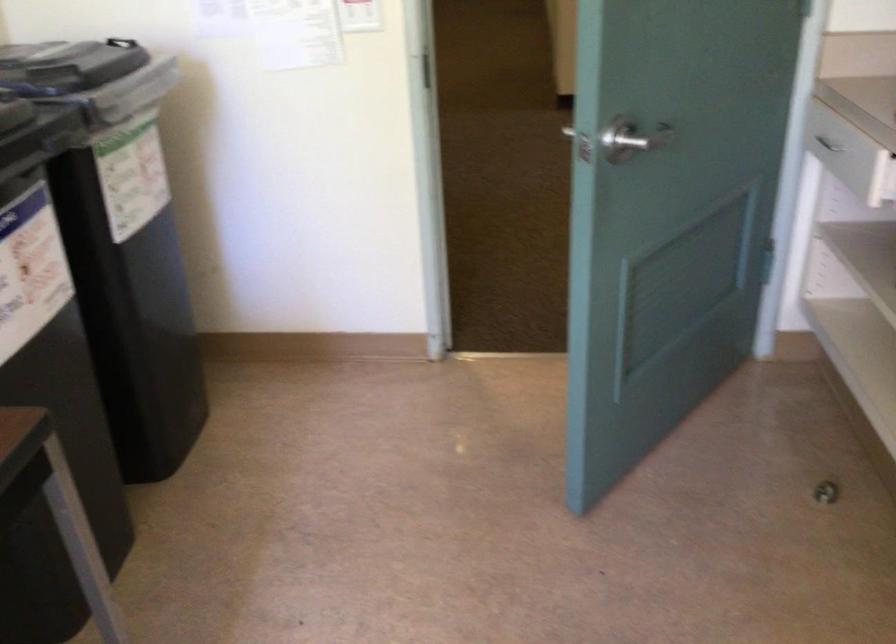
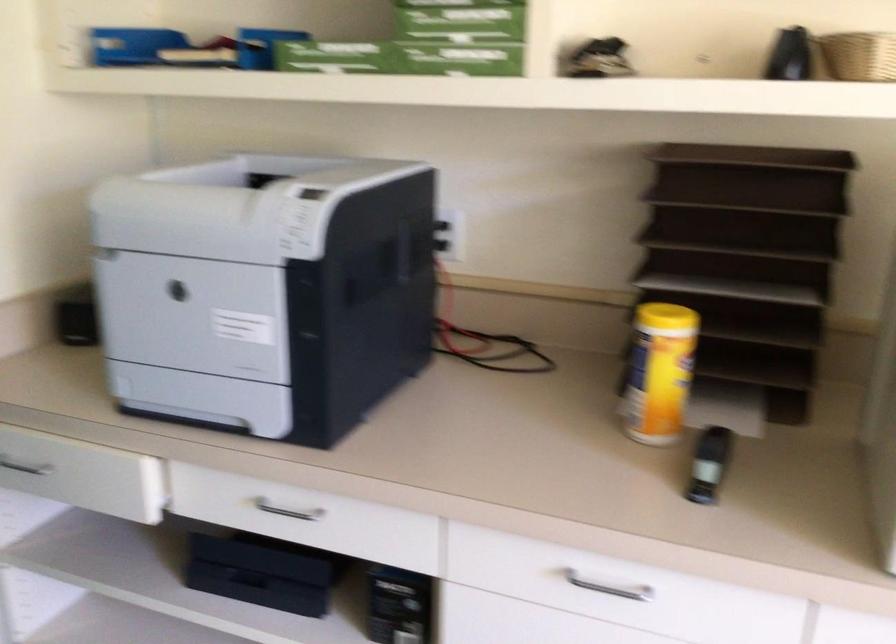
In the second image, find the point that corresponds to point (823, 138) in the first image.

(24, 467)